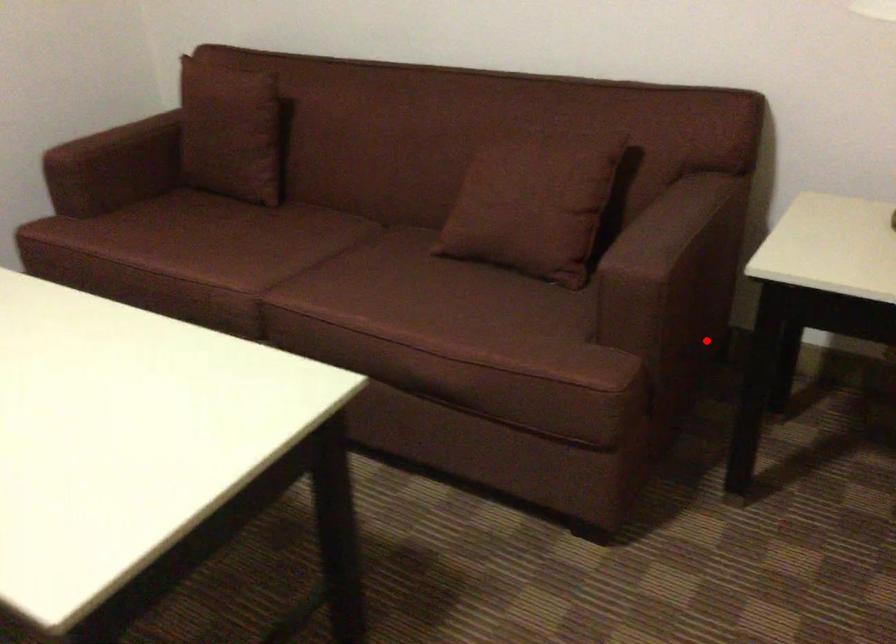
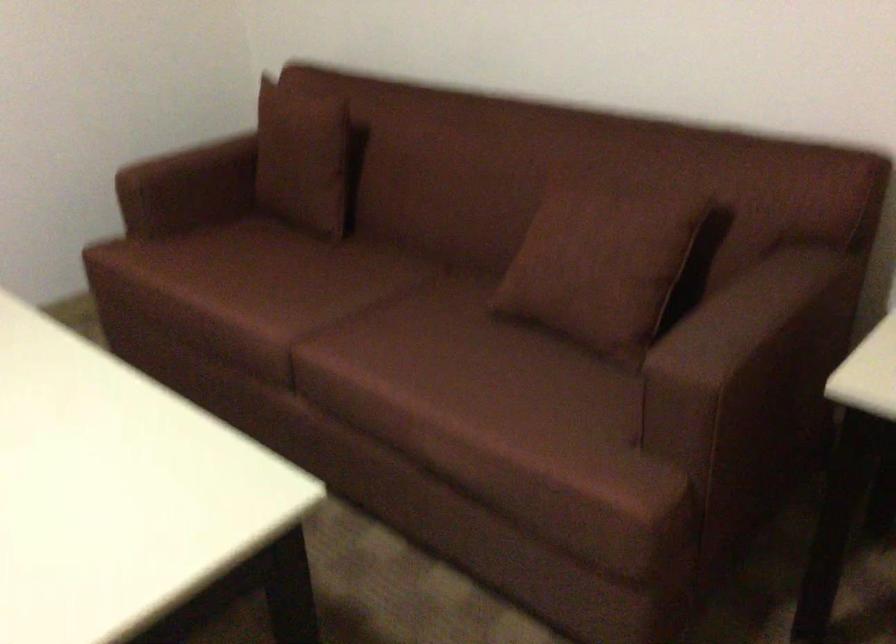
Question: I am providing you with two images of the same scene from different viewpoints. A red point is shown in image1. For the corresponding object point in image2, is it positioned nearer or farther from the camera?

Choices:
 (A) Nearer
 (B) Farther

Answer: (A)